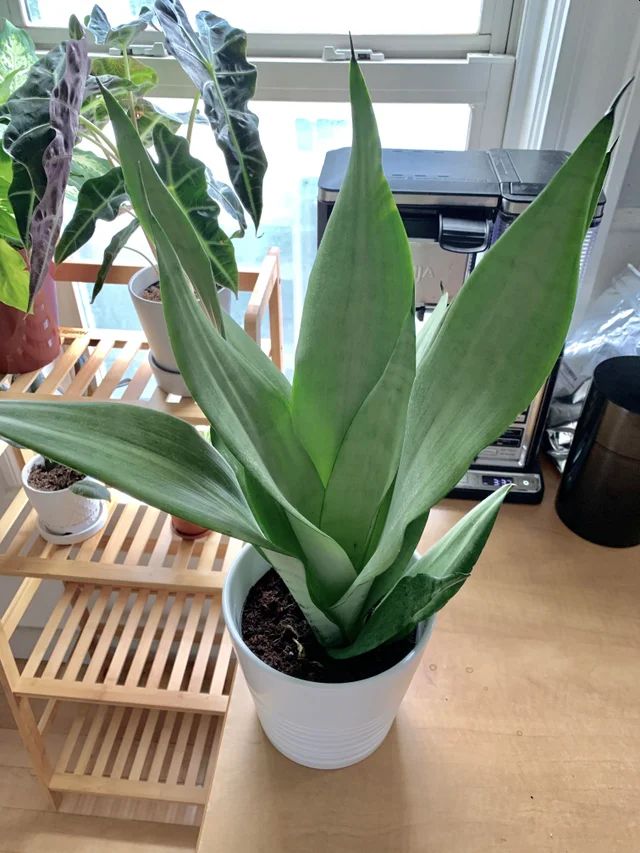
Identify the location of white baseboard. Image resolution: width=640 pixels, height=853 pixels. (26, 640).